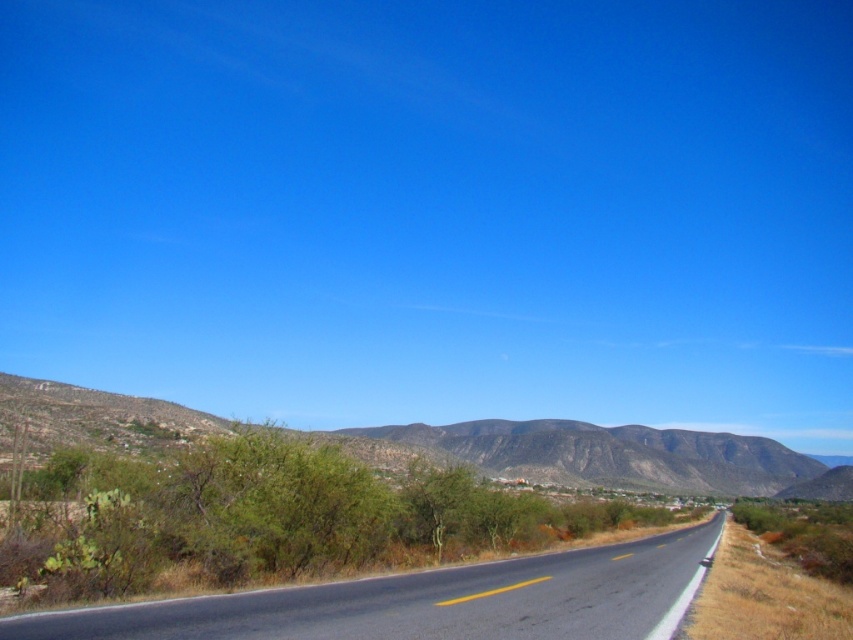
Is black asphalt road at center to the left of green shrubbery at lower left from the viewer's perspective?

Correct, you'll find black asphalt road at center to the left of green shrubbery at lower left.

Which is in front, point (10, 625) or point (672, 449)?

Positioned in front is point (10, 625).

The width and height of the screenshot is (853, 640). What do you see at coordinates (430, 602) in the screenshot? I see `black asphalt road at center` at bounding box center [430, 602].

At what (x,y) coordinates should I click in order to perform the action: click on black asphalt road at center. Please return your answer as a coordinate pair (x, y). Looking at the image, I should click on (430, 602).